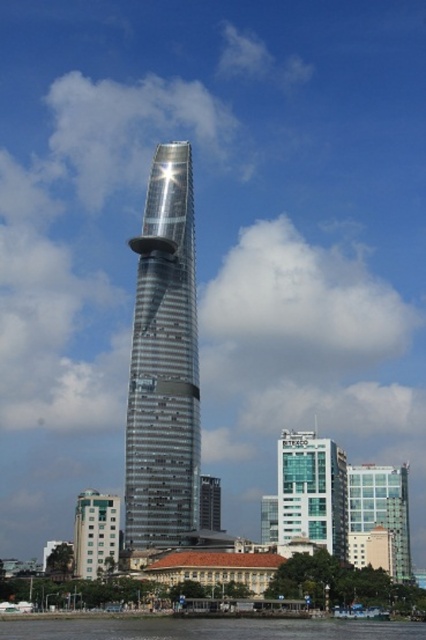
You are a drone operator trying to capture aerial shots of the skyscraper. You notice two points marked on your map at coordinates point (83, 637) and point (379, 484). Which point should you choose to get a closer shot of the skyscraper?

Point (83, 637) is closer to the camera than point (379, 484), so you should choose point (83, 637) to get a closer shot of the skyscraper.

Looking at this image, you are an architect analyzing the urban layout. You see the glassy teal skyscraper at center and the glassy metallic skyscraper at center. Which one is positioned higher in the image?

The glassy teal skyscraper at center is located above the glassy metallic skyscraper at center in the image.

You are standing at the base of the skyscraper and see the transparent water at lower center and the glassy transparent building at center. Which object is closer to your left side?

The transparent water at lower center is positioned on the left side of the glassy transparent building at center, so it is closer to your left side.